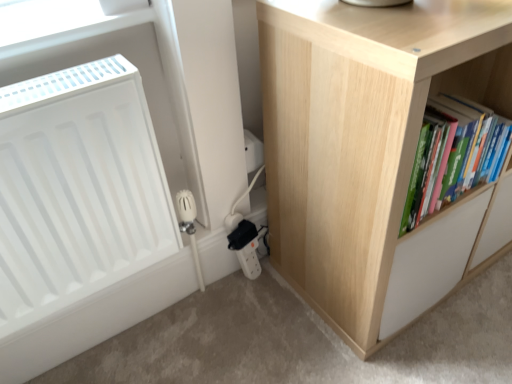
Question: Can you confirm if white matte radiator at left is bigger than green matte book at right?

Choices:
 (A) no
 (B) yes

Answer: (B)

Question: From the image's perspective, is white matte radiator at left above green matte book at right?

Choices:
 (A) yes
 (B) no

Answer: (B)

Question: Is white matte radiator at left positioned behind green matte book at right?

Choices:
 (A) yes
 (B) no

Answer: (B)

Question: Can you confirm if white matte radiator at left is thinner than green matte book at right?

Choices:
 (A) no
 (B) yes

Answer: (B)

Question: Does white matte radiator at left have a greater width compared to green matte book at right?

Choices:
 (A) yes
 (B) no

Answer: (B)

Question: Considering the relative positions of white matte radiator at left and green matte book at right in the image provided, is white matte radiator at left in front of green matte book at right?

Choices:
 (A) yes
 (B) no

Answer: (A)

Question: Considering the relative sizes of white matte radiator at left and natural wood cupboard at right in the image provided, is white matte radiator at left thinner than natural wood cupboard at right?

Choices:
 (A) no
 (B) yes

Answer: (B)

Question: From a real-world perspective, is white matte radiator at left positioned over natural wood cupboard at right based on gravity?

Choices:
 (A) yes
 (B) no

Answer: (A)

Question: From a real-world perspective, is white matte radiator at left beneath natural wood cupboard at right?

Choices:
 (A) no
 (B) yes

Answer: (A)

Question: From the image's perspective, is white matte radiator at left under natural wood cupboard at right?

Choices:
 (A) no
 (B) yes

Answer: (B)

Question: Is white matte radiator at left directly adjacent to natural wood cupboard at right?

Choices:
 (A) yes
 (B) no

Answer: (B)

Question: Considering the relative sizes of white matte radiator at left and natural wood cupboard at right in the image provided, is white matte radiator at left smaller than natural wood cupboard at right?

Choices:
 (A) no
 (B) yes

Answer: (B)

Question: Is green matte book at right at the left side of white matte radiator at left?

Choices:
 (A) no
 (B) yes

Answer: (A)